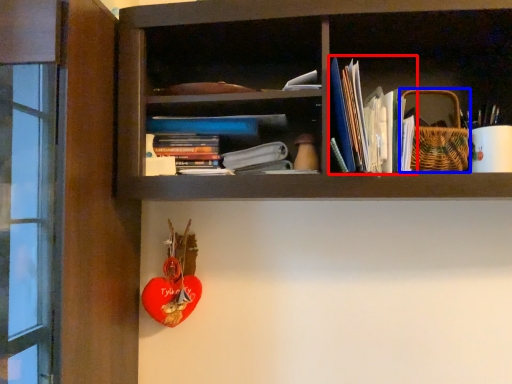
Question: Which object appears farthest to the camera in this image, book (highlighted by a red box) or basket (highlighted by a blue box)?

Choices:
 (A) book
 (B) basket

Answer: (B)